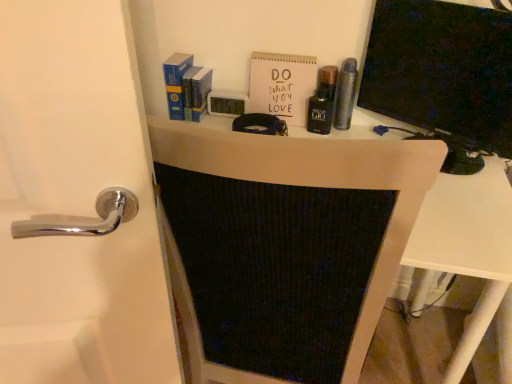
Question: Is point (347, 57) positioned closer to the camera than point (388, 87)?

Choices:
 (A) farther
 (B) closer

Answer: (A)

Question: In terms of size, does metallic silver canister at center, the first toiletry when ordered from right to left, appear bigger or smaller than matte black monitor at right?

Choices:
 (A) big
 (B) small

Answer: (B)

Question: Based on their relative distances, which object is farther from the matte black monitor at right?

Choices:
 (A) black glass bottle at upper center, the 1th toiletry from the left
 (B) metallic silver canister at center, the first toiletry when ordered from right to left
 (C) matte black monitor at center
 (D) blue hardcover book at upper left
 (E) white matte paper at upper center

Answer: (C)

Question: Based on their relative distances, which object is farther from the matte black monitor at center?

Choices:
 (A) black glass bottle at upper center, the 1th toiletry from the left
 (B) white matte paper at upper center
 (C) matte black monitor at right
 (D) blue hardcover book at upper left
 (E) metallic silver canister at center, positioned as the 2th toiletry in left-to-right order

Answer: (D)